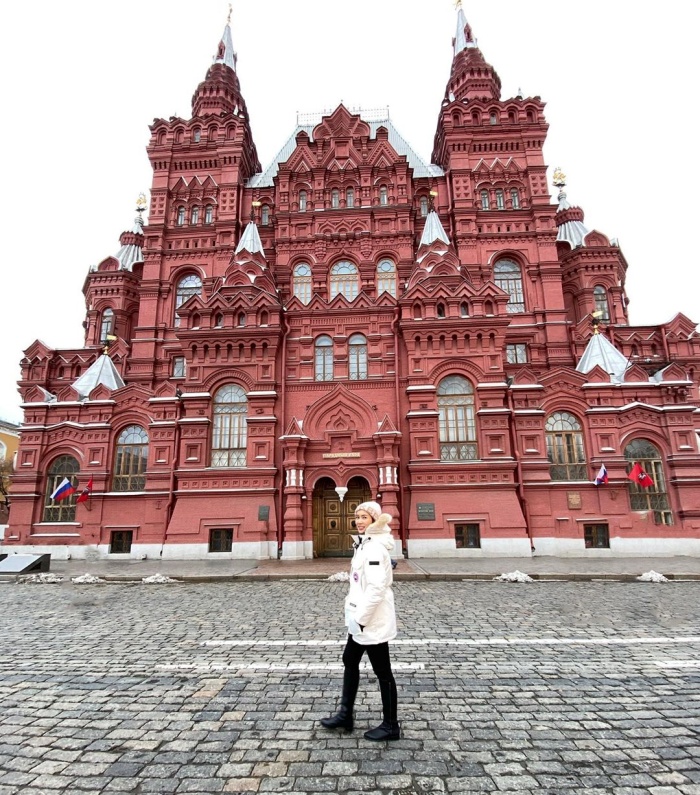
Find the location of a particular element. Image resolution: width=700 pixels, height=795 pixels. windows is located at coordinates (456, 417), (231, 425).